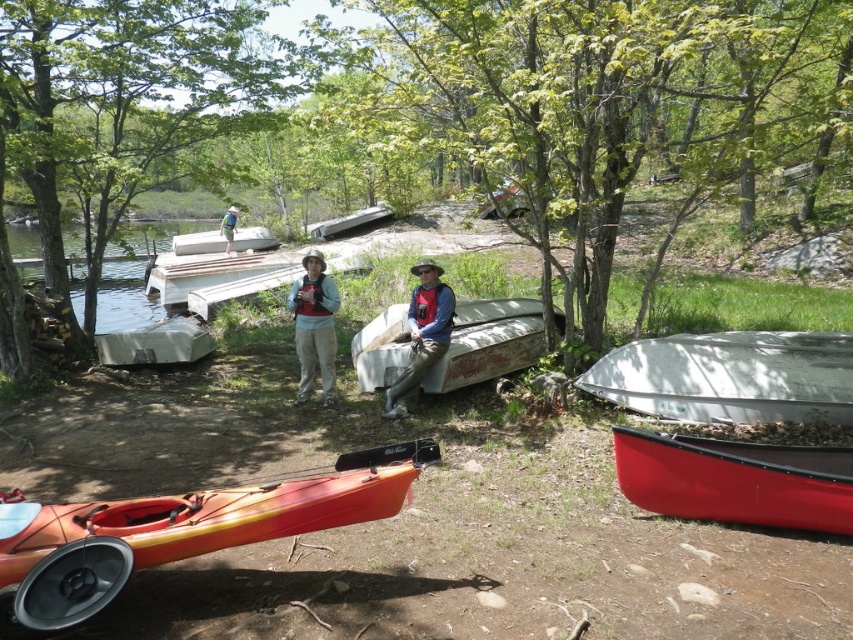
Question: Which is farther from the red matte canoe at lower right?

Choices:
 (A) white plastic canoe at upper center
 (B) orange matte kayak at lower left
 (C) matte gray life vest at center

Answer: (A)

Question: Is matte white kayak at center wider than matte gray kayak at center?

Choices:
 (A) yes
 (B) no

Answer: (B)

Question: Where is red matte canoe at lower right located in relation to white plastic canoe at upper center in the image?

Choices:
 (A) below
 (B) above

Answer: (A)

Question: In this image, where is green leafy tree at center located relative to white metallic boat at lower right?

Choices:
 (A) below
 (B) above

Answer: (B)

Question: Based on their relative distances, which object is nearer to the rusty metal boat at center?

Choices:
 (A) white plastic canoe at upper center
 (B) matte white kayak at center
 (C) matte gray life vest at center

Answer: (B)

Question: Which point is farther to the camera?

Choices:
 (A) (813, 474)
 (B) (97, 532)

Answer: (A)